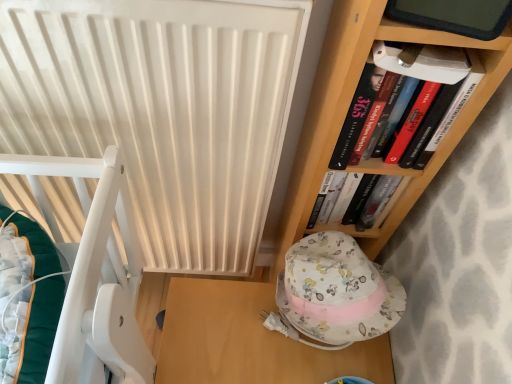
Question: From the image's perspective, is wooden table at lower center beneath white matte radiator at center?

Choices:
 (A) yes
 (B) no

Answer: (A)

Question: Can you confirm if wooden table at lower center is bigger than white matte radiator at center?

Choices:
 (A) yes
 (B) no

Answer: (B)

Question: Considering the relative positions of wooden table at lower center and white matte radiator at center in the image provided, is wooden table at lower center to the left of white matte radiator at center from the viewer's perspective?

Choices:
 (A) no
 (B) yes

Answer: (A)

Question: Is wooden table at lower center wider than white matte radiator at center?

Choices:
 (A) no
 (B) yes

Answer: (B)

Question: Is wooden table at lower center further to camera compared to white matte radiator at center?

Choices:
 (A) yes
 (B) no

Answer: (A)

Question: In terms of width, does wooden table at lower center look wider or thinner when compared to hardcover book at upper right?

Choices:
 (A) thin
 (B) wide

Answer: (B)

Question: Would you say wooden table at lower center is inside or outside hardcover book at upper right?

Choices:
 (A) inside
 (B) outside

Answer: (B)

Question: Considering the positions of wooden table at lower center and hardcover book at upper right in the image, is wooden table at lower center bigger or smaller than hardcover book at upper right?

Choices:
 (A) big
 (B) small

Answer: (A)

Question: Is wooden table at lower center taller or shorter than hardcover book at upper right?

Choices:
 (A) short
 (B) tall

Answer: (B)

Question: Considering the positions of hardcover book at upper right and white matte radiator at center in the image, is hardcover book at upper right bigger or smaller than white matte radiator at center?

Choices:
 (A) big
 (B) small

Answer: (B)

Question: From the image's perspective, is hardcover book at upper right located above or below white matte radiator at center?

Choices:
 (A) below
 (B) above

Answer: (B)

Question: In the image, is hardcover book at upper right positioned in front of or behind white matte radiator at center?

Choices:
 (A) front
 (B) behind

Answer: (B)

Question: In terms of height, does hardcover book at upper right look taller or shorter compared to white matte radiator at center?

Choices:
 (A) tall
 (B) short

Answer: (B)

Question: Do you think wooden table at lower center is within white matte radiator at center, or outside of it?

Choices:
 (A) outside
 (B) inside

Answer: (A)

Question: Is point (321, 355) positioned closer to the camera than point (105, 74)?

Choices:
 (A) closer
 (B) farther

Answer: (B)